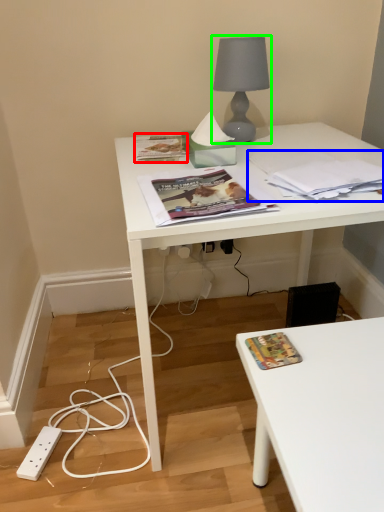
Question: Estimate the real-world distances between objects in this image. Which object is farther from paperback book (highlighted by a red box), paperback book (highlighted by a blue box) or lamp (highlighted by a green box)?

Choices:
 (A) paperback book
 (B) lamp

Answer: (A)